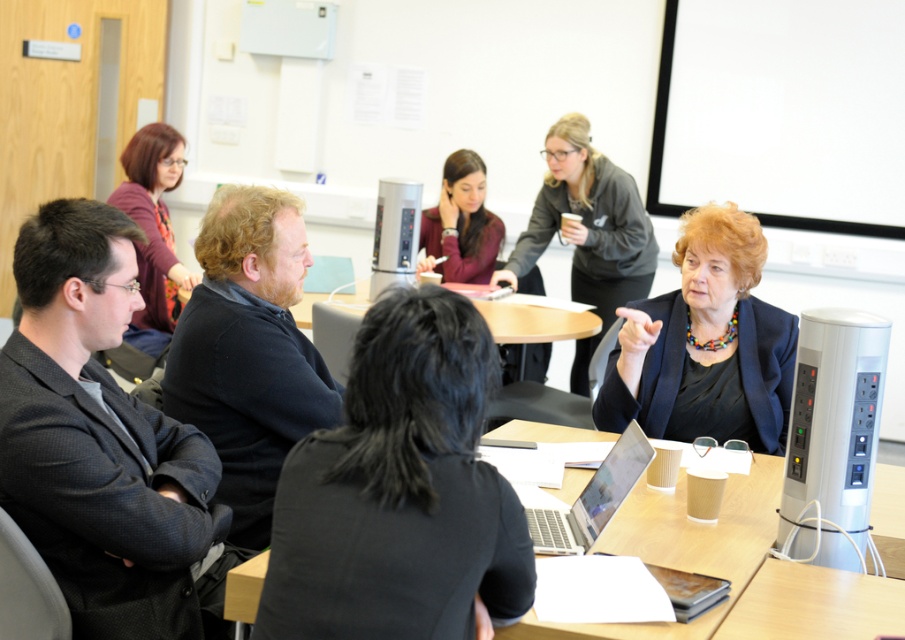
From the picture: Is wooden table at center above matte black jacket at upper left?

Actually, wooden table at center is below matte black jacket at upper left.

Does wooden table at center come in front of matte black jacket at upper left?

Yes.

Where is `wooden table at center`? Image resolution: width=905 pixels, height=640 pixels. wooden table at center is located at coordinates (683, 548).

Where is `wooden table at center`? This screenshot has width=905, height=640. wooden table at center is located at coordinates (683, 548).

Does black glossy blazer at center appear on the right side of dark blue blazer at center?

Correct, you'll find black glossy blazer at center to the right of dark blue blazer at center.

Is black glossy blazer at center shorter than dark blue blazer at center?

Correct, black glossy blazer at center is not as tall as dark blue blazer at center.

Between point (627, 344) and point (579, 387), which one is positioned in front?

Point (627, 344) is in front.

Find the location of a particular element. Image resolution: width=905 pixels, height=640 pixels. black glossy blazer at center is located at coordinates (x=705, y=344).

Is wooden table at center thinner than silver metallic laptop at center?

No, wooden table at center is not thinner than silver metallic laptop at center.

Between wooden table at center and silver metallic laptop at center, which one appears on the left side from the viewer's perspective?

Positioned to the left is silver metallic laptop at center.

Image resolution: width=905 pixels, height=640 pixels. In order to click on wooden table at center in this screenshot , I will do `click(683, 548)`.